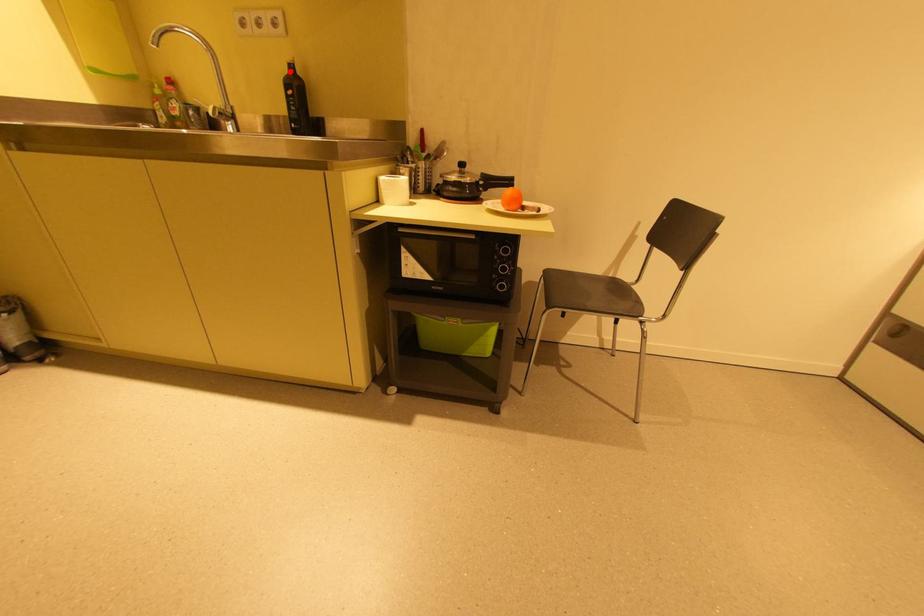
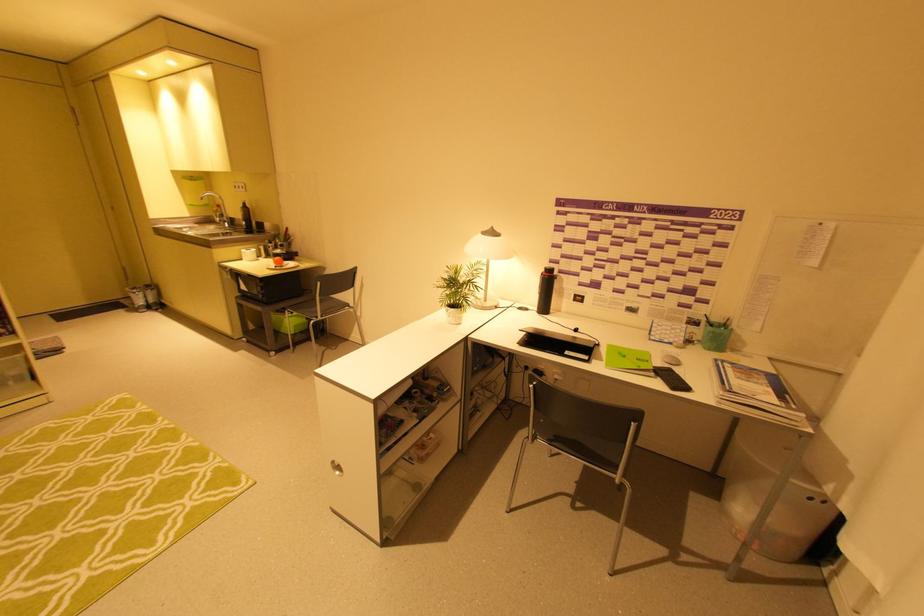
In the second image, find the point that corresponds to the highlighted location in the first image.

(246, 206)